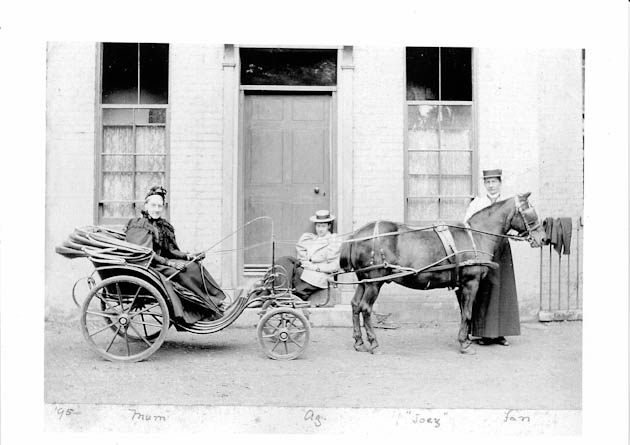
Where is `window`? The image size is (630, 445). window is located at coordinates (125, 175), (437, 167).